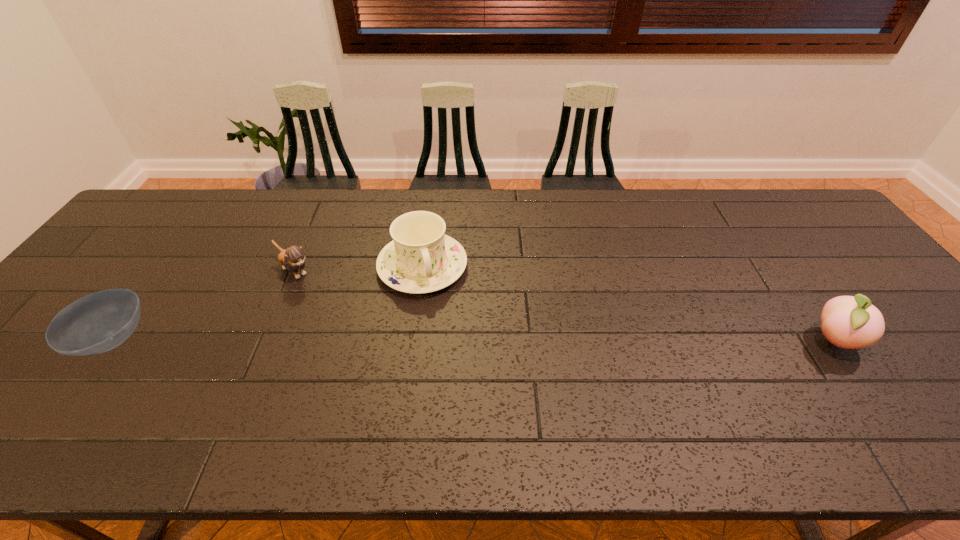
At what (x,y) coordinates should I click in order to perform the action: click on the leftmost object. Please return your answer as a coordinate pair (x, y). Looking at the image, I should click on (99, 322).

Identify the location of the shortest object. (99, 322).

Locate an element on the screen. The height and width of the screenshot is (540, 960). the rightmost object is located at coordinates (851, 322).

Find the location of a particular element. The image size is (960, 540). the third object from right to left is located at coordinates (292, 259).

The image size is (960, 540). Find the location of `the third tallest object`. the third tallest object is located at coordinates (292, 259).

Where is `chinaware`? This screenshot has height=540, width=960. chinaware is located at coordinates click(x=421, y=259).

Find the location of `blank space located on the back of the bowl`. blank space located on the back of the bowl is located at coordinates click(x=183, y=242).

Locate an element on the screen. free space located 0.190m on the back of the rightmost object is located at coordinates (782, 268).

This screenshot has height=540, width=960. Find the location of `free spot located 0.200m on the front-facing side of the kitten`. free spot located 0.200m on the front-facing side of the kitten is located at coordinates (352, 319).

You are a GUI agent. You are given a task and a screenshot of the screen. Output one action in this format:
    pyautogui.click(x=<x>, y=<y>)
    Task: Click on the vacant area located on the front-facing side of the kitten
    The width and height of the screenshot is (960, 540).
    Given the screenshot: What is the action you would take?
    pyautogui.click(x=352, y=319)